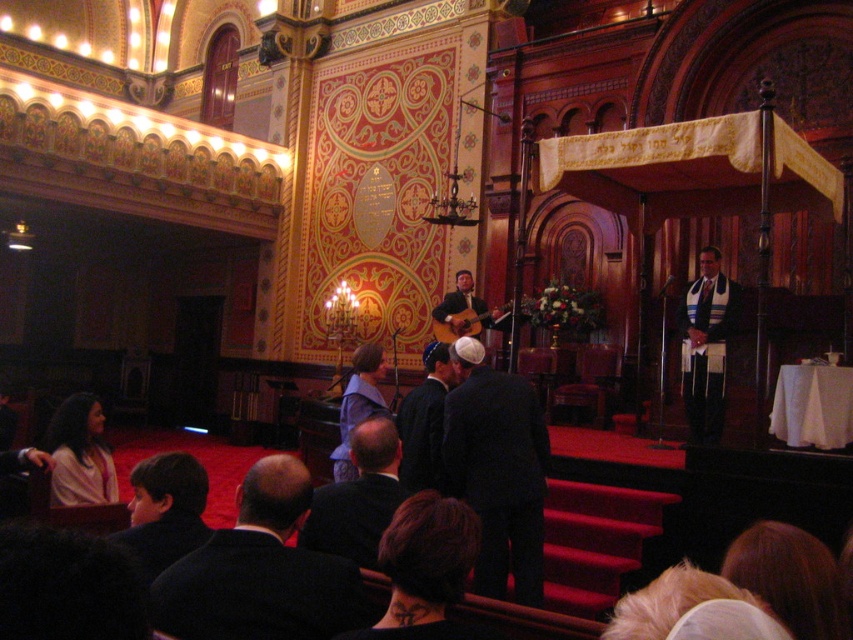
You are attending a ceremony in the synagogue. You see a white textured kippah at center and a matte pink sweater at lower left. Which object is located higher in the image?

The white textured kippah at center is positioned over the matte pink sweater at lower left, so it is higher in the image.

You are a photographer positioned at the entrance of the hall. You need to capture a photo that includes both the dark brown suit at lower left and the matte pink sweater at lower left. What is the minimum distance you need to move backward to ensure both subjects are in frame?

The dark brown suit at lower left and matte pink sweater at lower left are 5.17 meters apart from each other. To include both in the photo, you need to move backward until the camera can capture a field of view that accommodates this distance. Assuming a standard camera with a 50mm lens, moving back approximately 5 meters should allow both subjects to be in frame, as the field of view at that distance would cover the 5.17 meter gap between them.